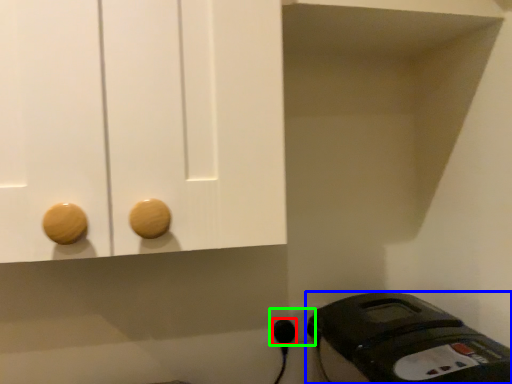
Question: Considering the real-world distances, which object is closest to plug (highlighted by a red box)? home appliance (highlighted by a blue box) or electric outlet (highlighted by a green box).

Choices:
 (A) home appliance
 (B) electric outlet

Answer: (B)